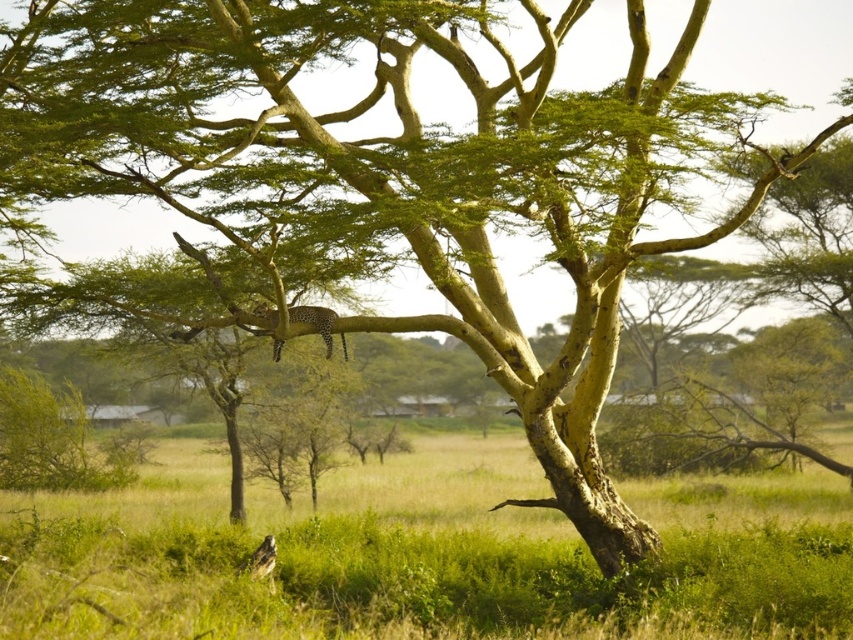
You are a wildlife photographer aiming to capture both the spotted fur cheetah at upper center and the spotted fur leopard at lower left in a single frame. Based on their positions, which animal would appear closer to the camera in your photo?

The spotted fur cheetah at upper center is in front of the spotted fur leopard at lower left, so it would appear closer to the camera in the photo.

Based on the photo, you are a safari guide leading a group through the savanna. You notice both the spotted fur cheetah at upper center and the spotted fur leopard at lower left. Which big cat is positioned higher in the scene?

The spotted fur cheetah at upper center is positioned higher in the scene than the spotted fur leopard at lower left.